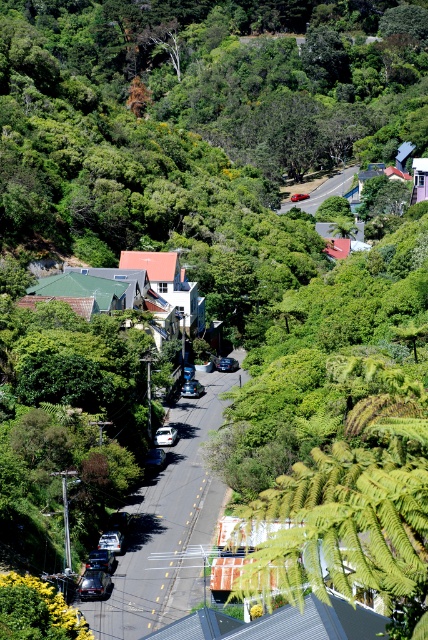
You are a delivery driver trying to park your truck, which is 2 meters wide, between the white matte car at center and the metallic blue sedan at center. Can your truck fit in the space between them?

The white matte car at center is thinner than the metallic blue sedan at center, but the description does not provide the exact width of the space between them. Therefore, it is uncertain if the truck can fit.

You are a delivery driver who needs to park your white matte car at center in a spot that is exactly at coordinates 0.681, 0.386. Is there enough space for your car to park there?

The white matte car at center is already positioned at point (165,435), so there is enough space for it to park there.

You are standing at the point with coordinates (165, 435) in the image. What object is located at this point?

The point at coordinates (165, 435) indicates the white matte car at center.